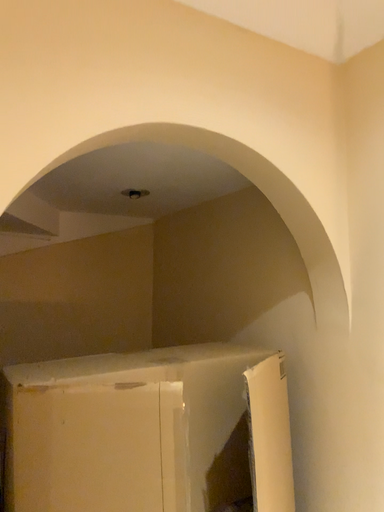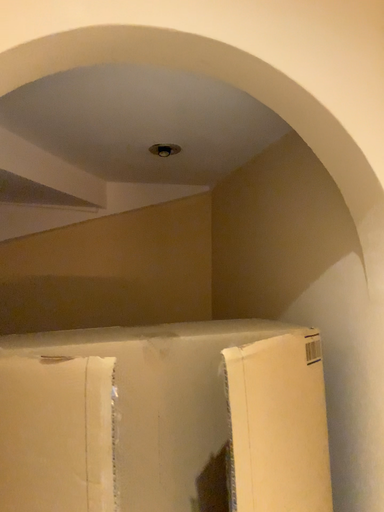
Question: Which way did the camera rotate in the video?

Choices:
 (A) rotated right
 (B) rotated left

Answer: (B)